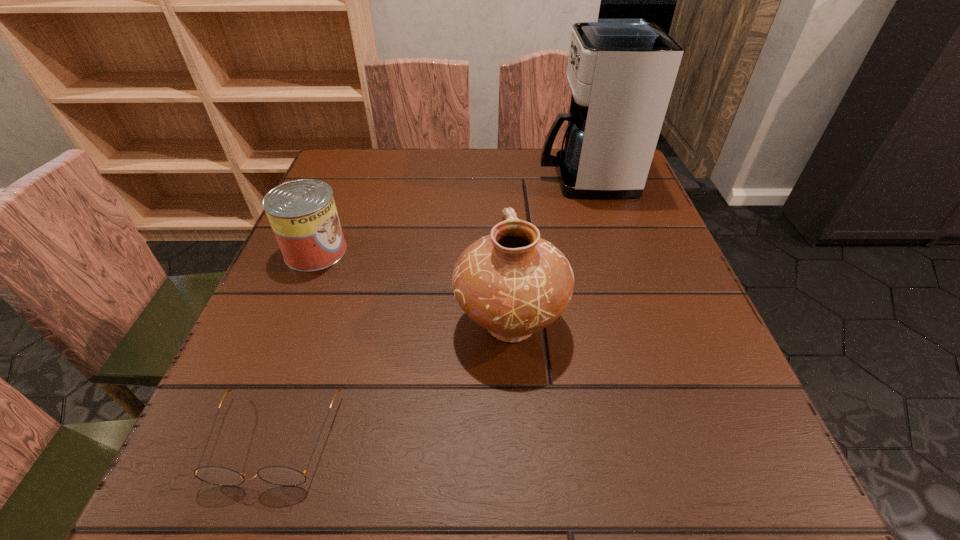
Where is `coffee maker`? coffee maker is located at coordinates (621, 72).

The image size is (960, 540). Identify the location of the rightmost object. (621, 72).

This screenshot has height=540, width=960. Find the location of `the third object from left to right`. the third object from left to right is located at coordinates (513, 283).

At what (x,y) coordinates should I click in order to perform the action: click on the second nearest object. Please return your answer as a coordinate pair (x, y). The height and width of the screenshot is (540, 960). Looking at the image, I should click on (513, 283).

This screenshot has width=960, height=540. Identify the location of the second shortest object. (302, 213).

Find the location of a particular element. Image resolution: width=960 pixels, height=540 pixels. the second farthest object is located at coordinates (302, 213).

Locate an element on the screen. The height and width of the screenshot is (540, 960). the shortest object is located at coordinates (278, 475).

The height and width of the screenshot is (540, 960). I want to click on spectacles, so click(x=278, y=475).

Identify the location of vacant space located on the front panel of the farthest object. The width and height of the screenshot is (960, 540). (495, 179).

Where is `vacant space located on the front panel of the farthest object`? Image resolution: width=960 pixels, height=540 pixels. vacant space located on the front panel of the farthest object is located at coordinates (483, 179).